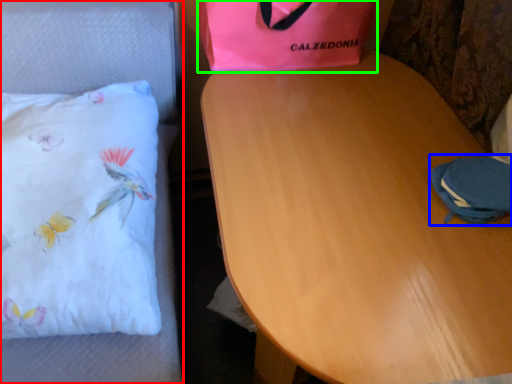
Question: Considering the real-world distances, which object is closest to furniture (highlighted by a red box)? pouch (highlighted by a blue box) or gift bag (highlighted by a green box).

Choices:
 (A) pouch
 (B) gift bag

Answer: (B)